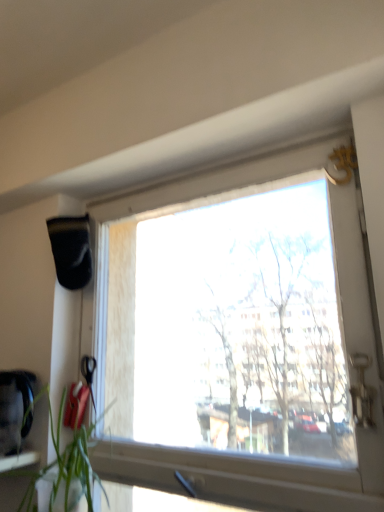
Question: From a real-world perspective, is green leafy plant at lower left under transparent glass window at center?

Choices:
 (A) no
 (B) yes

Answer: (B)

Question: Can you confirm if green leafy plant at lower left is wider than transparent glass window at center?

Choices:
 (A) yes
 (B) no

Answer: (A)

Question: Is green leafy plant at lower left in front of transparent glass window at center?

Choices:
 (A) no
 (B) yes

Answer: (B)

Question: Is green leafy plant at lower left at the left side of transparent glass window at center?

Choices:
 (A) yes
 (B) no

Answer: (A)

Question: From the image's perspective, is green leafy plant at lower left on top of transparent glass window at center?

Choices:
 (A) yes
 (B) no

Answer: (B)

Question: Could you tell me if green leafy plant at lower left is facing transparent glass window at center?

Choices:
 (A) yes
 (B) no

Answer: (B)

Question: Considering the relative sizes of transparent glass window at center and green leafy plant at lower left in the image provided, is transparent glass window at center shorter than green leafy plant at lower left?

Choices:
 (A) yes
 (B) no

Answer: (B)

Question: Considering the relative sizes of transparent glass window at center and green leafy plant at lower left in the image provided, is transparent glass window at center smaller than green leafy plant at lower left?

Choices:
 (A) yes
 (B) no

Answer: (B)

Question: Is transparent glass window at center taller than green leafy plant at lower left?

Choices:
 (A) no
 (B) yes

Answer: (B)

Question: Is transparent glass window at center wider than green leafy plant at lower left?

Choices:
 (A) yes
 (B) no

Answer: (B)

Question: Is transparent glass window at center positioned with its back to green leafy plant at lower left?

Choices:
 (A) no
 (B) yes

Answer: (B)

Question: Considering the relative sizes of transparent glass window at center and green leafy plant at lower left in the image provided, is transparent glass window at center thinner than green leafy plant at lower left?

Choices:
 (A) yes
 (B) no

Answer: (A)

Question: In terms of size, does transparent glass window at center appear bigger or smaller than green leafy plant at lower left?

Choices:
 (A) big
 (B) small

Answer: (A)